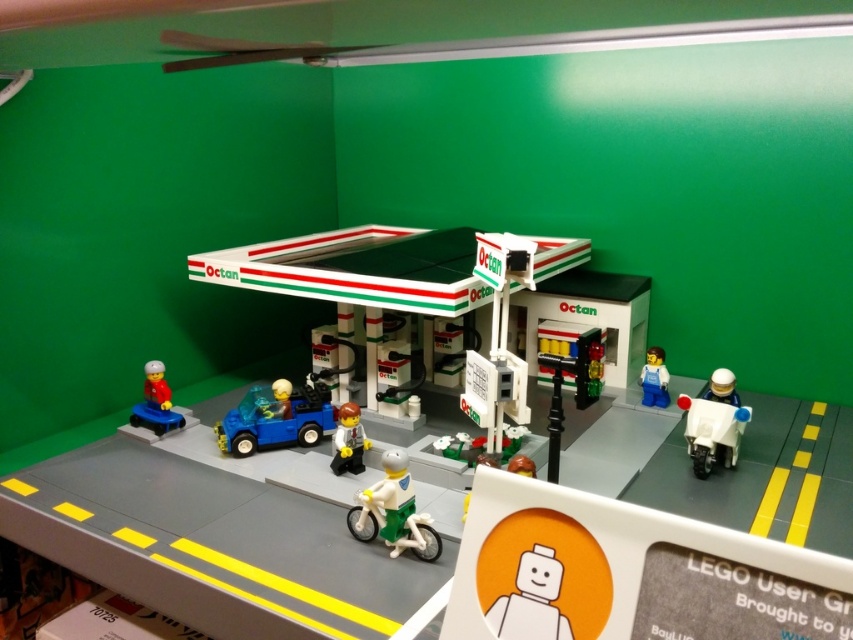
You are a visitor at the LEGO gas station scene. You see a white plastic motorcycle at lower right and a smooth white minifigure at center. Which object is closer to you?

The white plastic motorcycle at lower right is closer to you because it is in front of the smooth white minifigure at center.